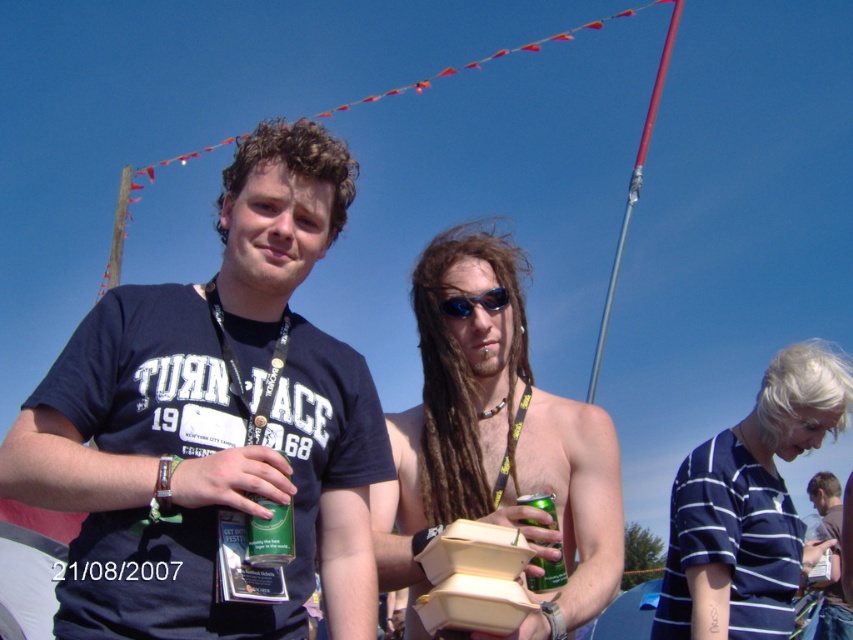
Based on the photo, who is more distant from viewer, (28, 448) or (469, 304)?

The point (469, 304) is behind.

The width and height of the screenshot is (853, 640). I want to click on matte blue t-shirt at center, so click(213, 422).

Describe the element at coordinates (213, 422) in the screenshot. The width and height of the screenshot is (853, 640). I see `matte blue t-shirt at center` at that location.

Image resolution: width=853 pixels, height=640 pixels. I want to click on matte blue t-shirt at center, so click(x=213, y=422).

Is matte blue t-shirt at center positioned before shiny silver can at center?

That is True.

Which is more to the left, matte blue t-shirt at center or shiny silver can at center?

Positioned to the left is matte blue t-shirt at center.

Where is `matte blue t-shirt at center`? This screenshot has height=640, width=853. matte blue t-shirt at center is located at coordinates (213, 422).

Identify the location of matte blue t-shirt at center. (213, 422).

Who is lower down, matte blue t-shirt at center or green matte can at center?

green matte can at center is below.

Measure the distance between point [128,589] and camera.

Point [128,589] is 108.73 feet away from camera.

Find the location of `matte blue t-shirt at center`. matte blue t-shirt at center is located at coordinates (213, 422).